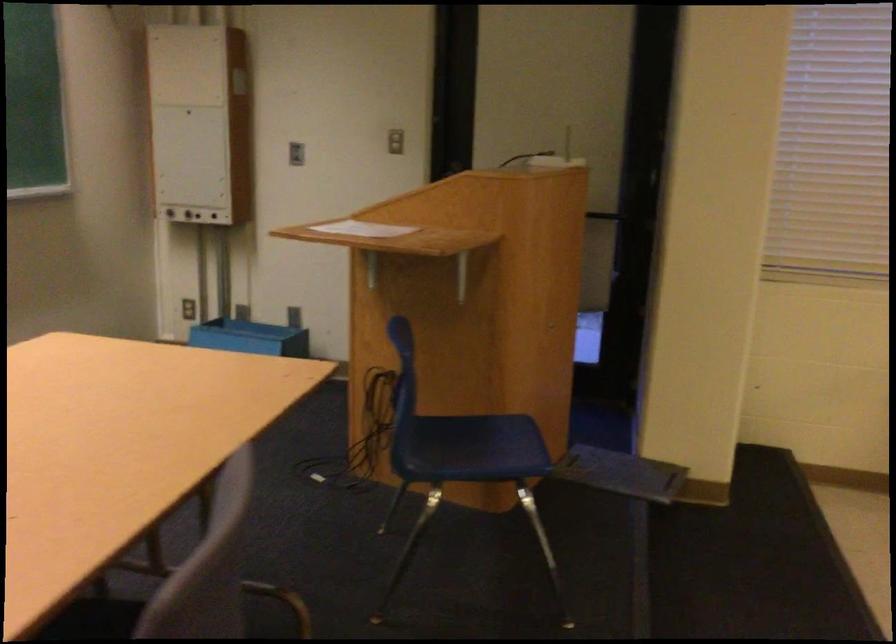
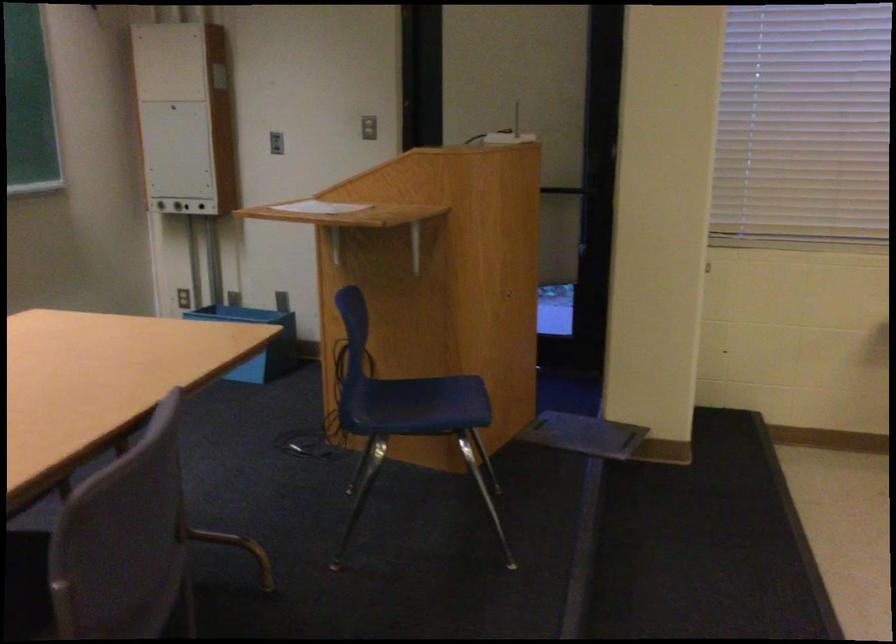
Find the pixel in the second image that matches the point at 314,381 in the first image.

(256, 341)